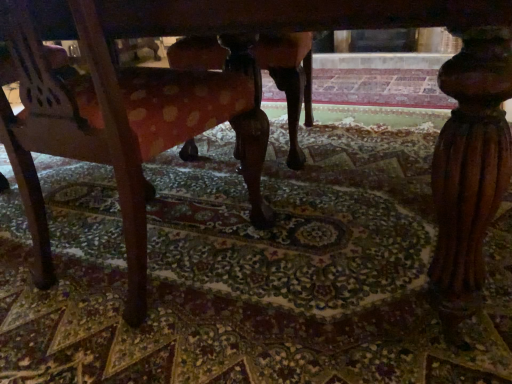
The image size is (512, 384). Describe the element at coordinates (123, 121) in the screenshot. I see `wooden chair at lower left` at that location.

Measure the distance between point (132, 193) and camera.

34.96 inches.

Measure the distance between wooden chair at lower left and camera.

The distance of wooden chair at lower left from camera is 26.79 inches.

Locate an element on the screen. wooden chair at lower left is located at coordinates (123, 121).

You are a GUI agent. You are given a task and a screenshot of the screen. Output one action in this format:
    pyautogui.click(x=<x>, y=<y>)
    Task: Click on the wooden chair at lower left
    
    Given the screenshot: What is the action you would take?
    pyautogui.click(x=123, y=121)